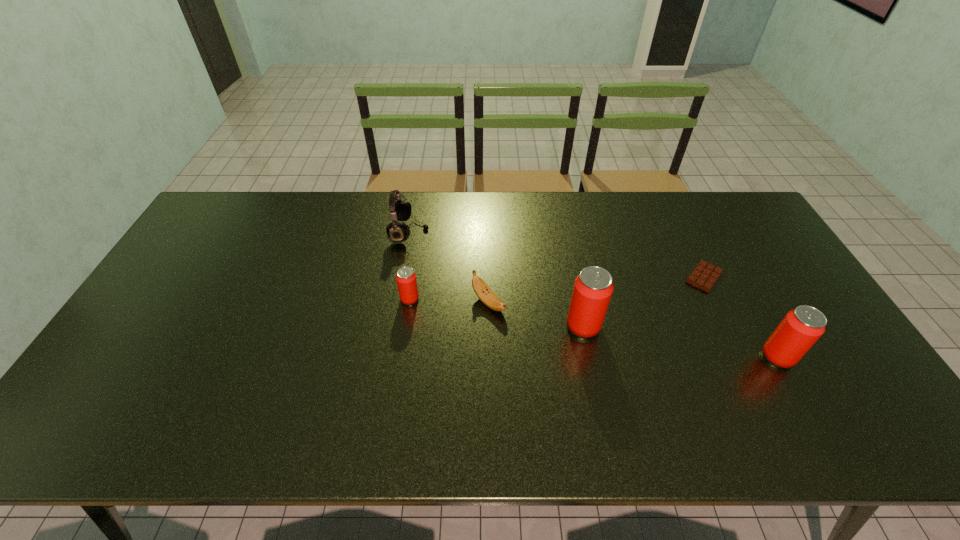
The width and height of the screenshot is (960, 540). In the image, there is a desktop. In order to click on blank space at the left edge in this screenshot , I will do `click(141, 349)`.

In the image, there is a desktop. In order to click on blank space at the far left corner in this screenshot , I will do `click(197, 231)`.

Where is `vacant area at the far right corner of the desktop`? The height and width of the screenshot is (540, 960). vacant area at the far right corner of the desktop is located at coordinates (754, 227).

Identify the location of free region at the near right corner of the desktop. (798, 374).

You are a GUI agent. You are given a task and a screenshot of the screen. Output one action in this format:
    pyautogui.click(x=<x>, y=<y>)
    Task: Click on the free space between the fourth object from right to left and the fourth object from left to right
    The image size is (960, 540).
    Given the screenshot: What is the action you would take?
    pyautogui.click(x=536, y=315)

The width and height of the screenshot is (960, 540). Identify the location of empty location between the candy bar and the leftmost beer can. (557, 288).

Find the location of `free space between the second shortest beer can and the third object from right to left`. free space between the second shortest beer can and the third object from right to left is located at coordinates (681, 341).

Locate an element on the screen. The image size is (960, 540). free space between the third shortest object and the farthest object is located at coordinates [410, 266].

Find the location of a particular element. free space between the shortest beer can and the shortest object is located at coordinates (557, 288).

The height and width of the screenshot is (540, 960). What are the coordinates of `vacant area that lies between the fourth object from left to right and the headset` in the screenshot? It's located at (496, 279).